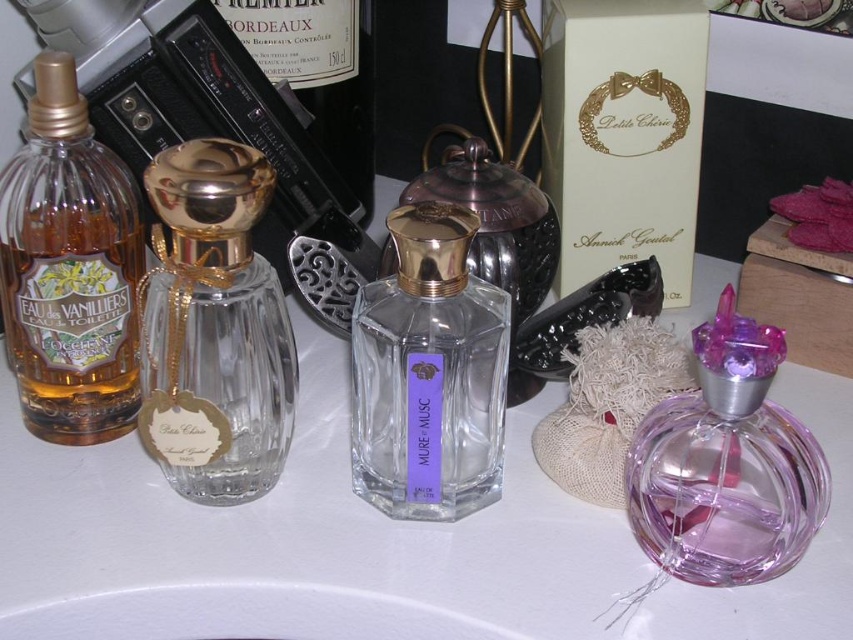
You are organizing a display of perfume bottles on the white matte counter top at center. You have a new transparent plastic perfume at lower right to place. Considering the size of the counter top, will it fit comfortably without overcrowding?

The white matte counter top at center is larger in size than the transparent plastic perfume at lower right, so placing the transparent plastic perfume at lower right on it should fit comfortably without overcrowding.

You are standing in front of the perfume display. The matte glass bottle at left is positioned closer to you than the other bottles. Which bottle should you reach for first if you want to pick up the one nearest to you?

The matte glass bottle at left is the closest to you, so you should reach for the matte glass bottle at left first.

You are a delivery person who needs to place a new perfume bottle between the matte glass bottle at left and the gold metallic bottle at upper center. The new bottle is 5 inches long. Can it fit in the space between them?

The space between the matte glass bottle at left and the gold metallic bottle at upper center is 10.91 inches. Since the new bottle is only 5 inches long, it can fit comfortably within the available space.